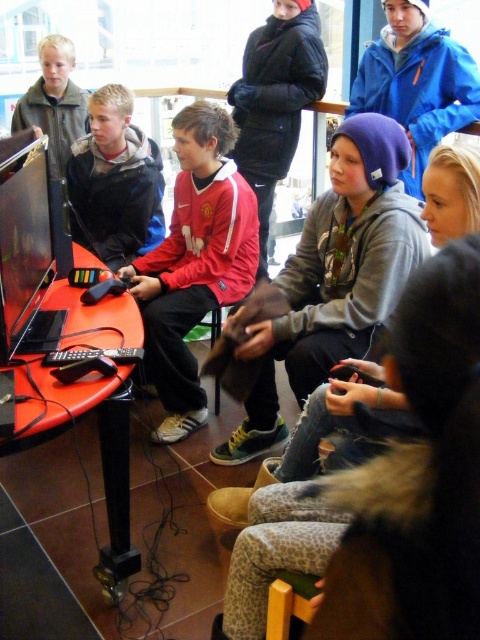
You are a photographer trying to capture a group photo of the children around the gaming table. You notice the blue fleece jacket at upper center and the matte black jacket at center. Which jacket should you focus on to ensure it fits entirely within your camera frame if your current frame can only accommodate the width of the narrower jacket?

The blue fleece jacket at upper center has a larger width than the matte black jacket at center. Since your camera frame can only fit the narrower jacket, you should focus on the matte black jacket at center to ensure it fits entirely within the frame.

You are a photographer trying to capture a photo of the children playing the video game. You want to ensure that both the red jersey at center and the matte black jacket at center are clearly visible in the shot. Based on their positions, which child should you focus on to ensure both are in focus?

The red jersey at center is in front of the matte black jacket at center, so focusing on the child wearing the red jersey at center will ensure both are in focus since the matte black jacket at center is behind it.

You are a photographer standing in front of the gaming setup. You notice two items at the center of the image, the red jersey at center and the matte black jacket at center. Which one is positioned lower?

The red jersey at center is below matte black jacket at center, so the red jersey at center is positioned lower.